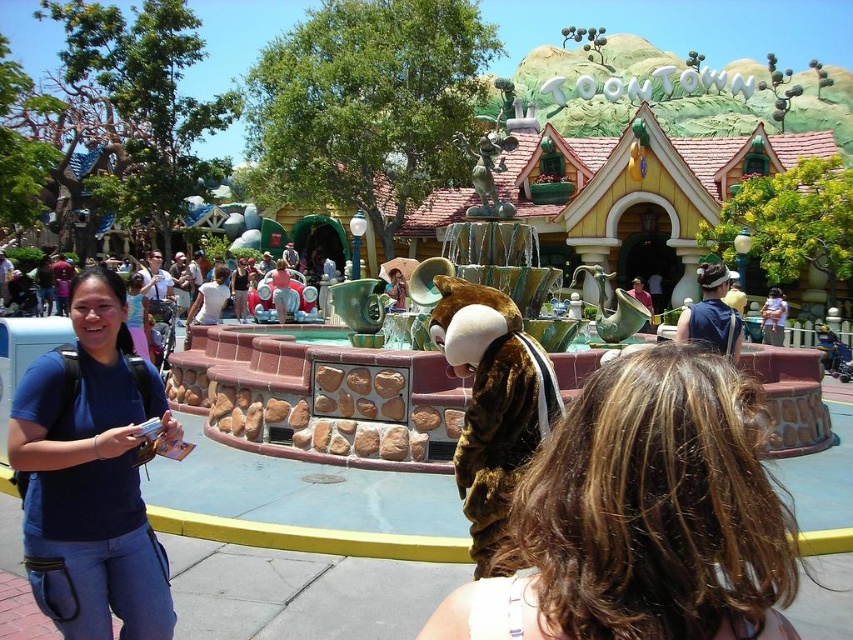
Question: Does brown hair at center lie behind blue fabric shirt at center?

Choices:
 (A) yes
 (B) no

Answer: (B)

Question: Is brown hair at center bigger than blue fabric shirt at center?

Choices:
 (A) no
 (B) yes

Answer: (A)

Question: Which point is farther to the camera?

Choices:
 (A) brown hair at center
 (B) blue fabric shirt at center

Answer: (B)

Question: Which point appears farthest from the camera in this image?

Choices:
 (A) (708, 492)
 (B) (140, 532)

Answer: (B)

Question: Can you confirm if brown hair at center is positioned to the right of blue fabric shirt at center?

Choices:
 (A) no
 (B) yes

Answer: (B)

Question: Which point is farther to the camera?

Choices:
 (A) brown hair at center
 (B) blue fabric shirt at center

Answer: (B)